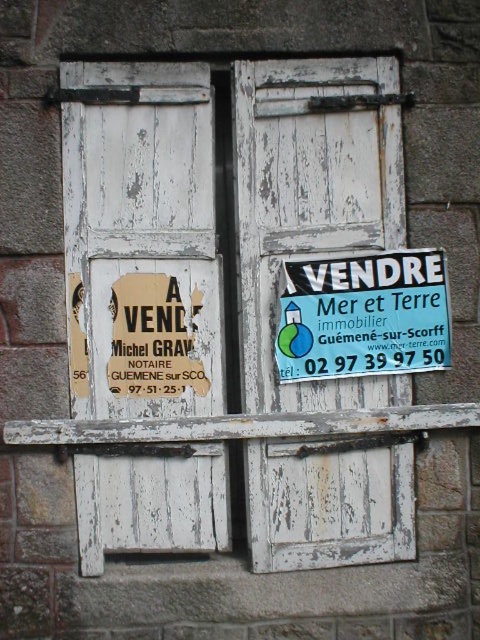
You are standing in front of the weathered wooden window with shutters and want to take a photo of the white wooden door at center. Your camera has a maximum focus range of 3 meters. Will you be able to capture the door clearly?

The white wooden door at center and camera are 2.86 meters apart, which is within the camera maximum focus range of 3 meters. So yes, you can capture the door clearly.

You are a traveler passing by a historic building and notice a white wooden door at center and a blue plastic sign at center. Which object is positioned higher up?

The white wooden door at center is located above the blue plastic sign at center, so it is positioned higher up.